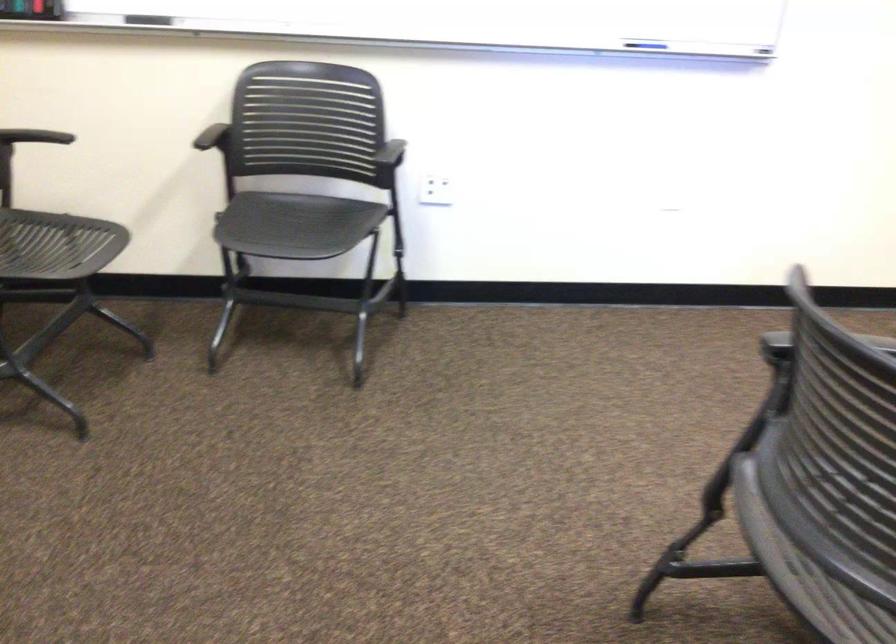
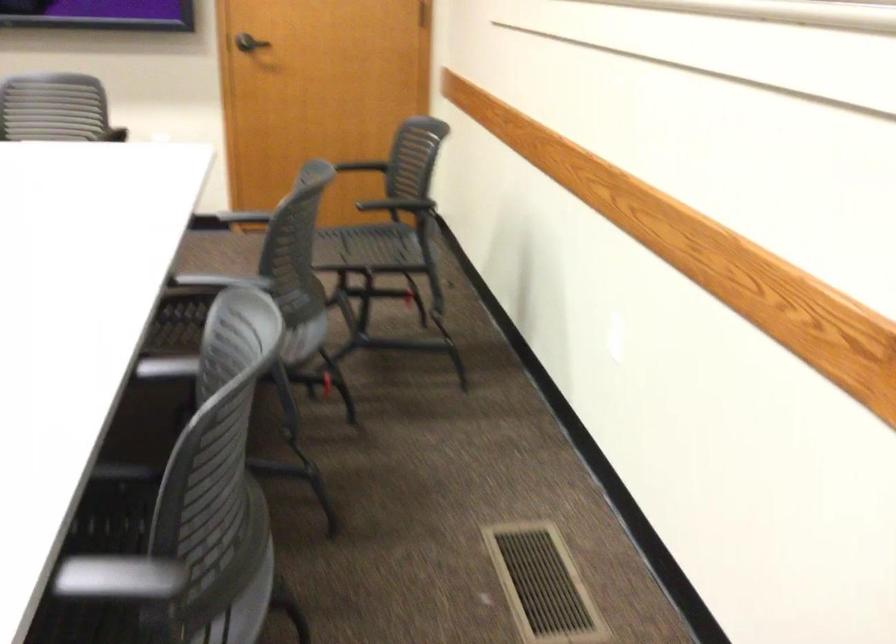
In the scene shown: Based on the continuous images, in which direction is the camera rotating?

The camera's rotation is toward right-down.